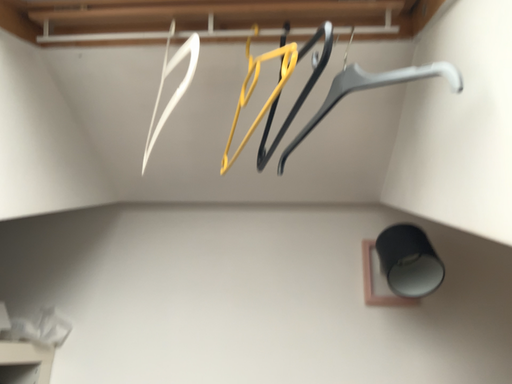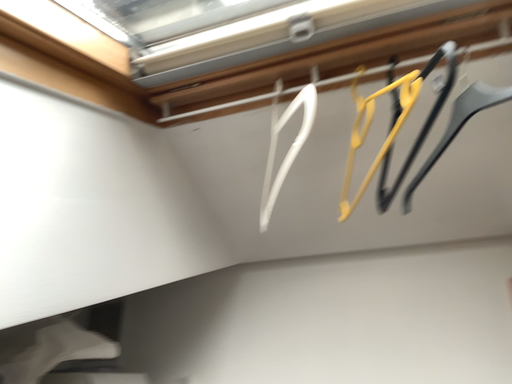
Question: How did the camera likely rotate when shooting the video?

Choices:
 (A) rotated downward
 (B) rotated upward

Answer: (B)